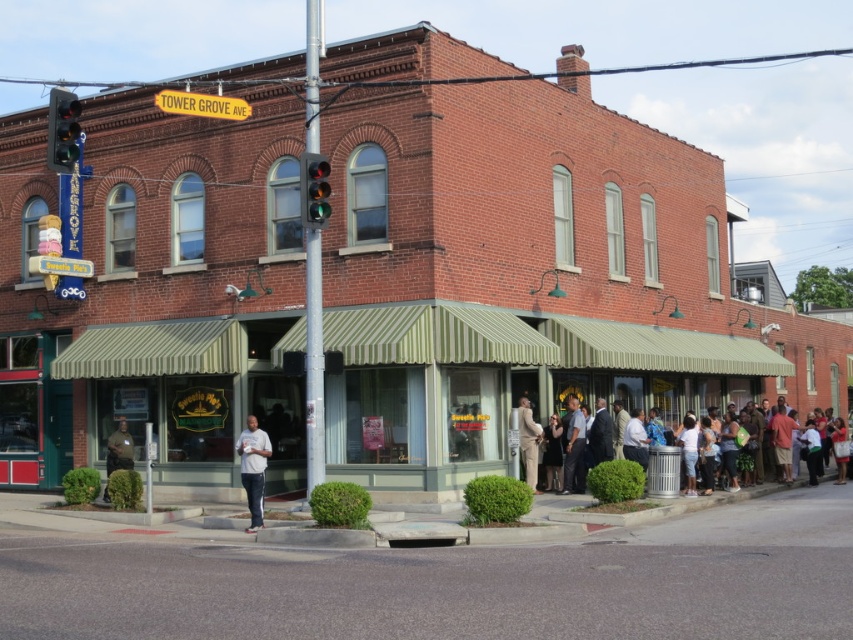
Question: Estimate the real-world distances between objects in this image. Which object is farther from the dark brown leather jacket at lower left?

Choices:
 (A) gray cotton shirt at center
 (B) metallic pole at center
 (C) dark brown fabric crowd at center

Answer: (B)

Question: Which point is closer to the camera taking this photo?

Choices:
 (A) (601, 448)
 (B) (572, 488)
 (C) (318, 228)
 (D) (518, 428)

Answer: (C)

Question: Can you confirm if green glass traffic light at upper left is thinner than gray cotton shirt at center?

Choices:
 (A) no
 (B) yes

Answer: (A)

Question: Which of the following is the farthest from the observer?

Choices:
 (A) dark gray suit at lower right
 (B) dark brown fabric crowd at center
 (C) transparent glass traffic light at upper center
 (D) tan fabric suit at center

Answer: (A)

Question: Can you confirm if transparent glass traffic light at upper center is bigger than tan fabric suit at center?

Choices:
 (A) no
 (B) yes

Answer: (A)

Question: Is yellowmaterial/texturestreet sign at upper center above dark brown leather jacket at lower left?

Choices:
 (A) yes
 (B) no

Answer: (A)